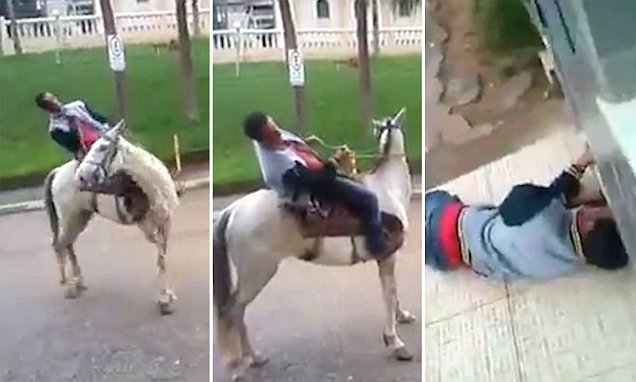
Image resolution: width=636 pixels, height=382 pixels. What are the coordinates of `photographs` in the screenshot? It's located at (481, 168), (327, 150), (130, 162).